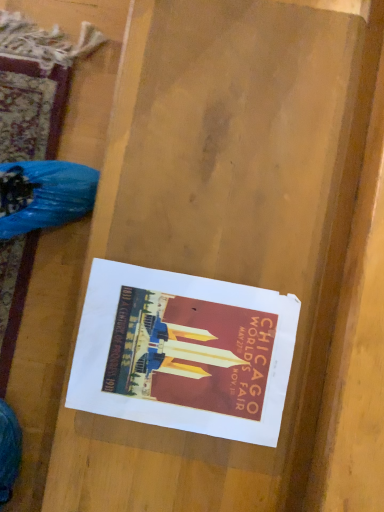
Image resolution: width=384 pixels, height=512 pixels. I want to click on free spot above white paper poster at center (from a real-world perspective), so click(176, 353).